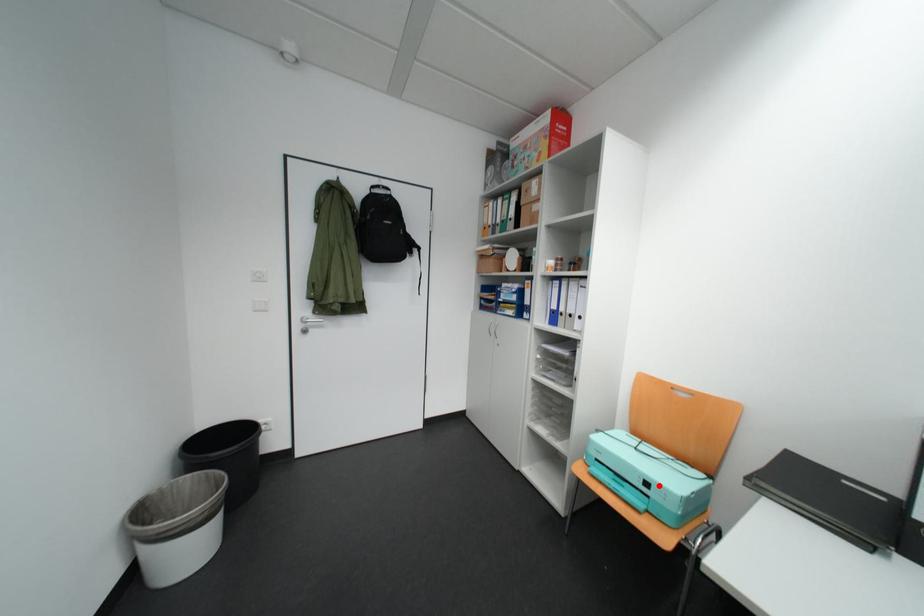
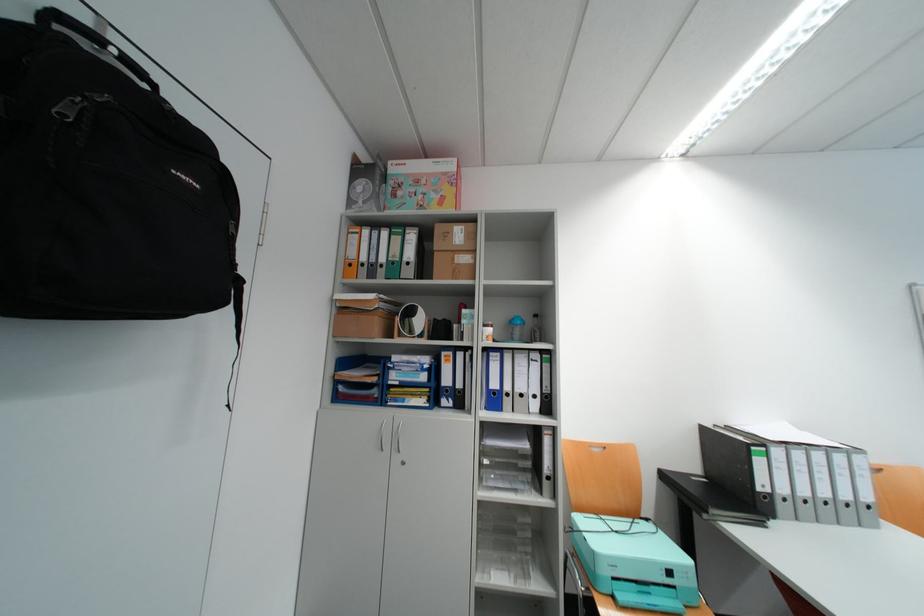
In the second image, find the point that corresponds to the highlighted location in the first image.

(682, 573)